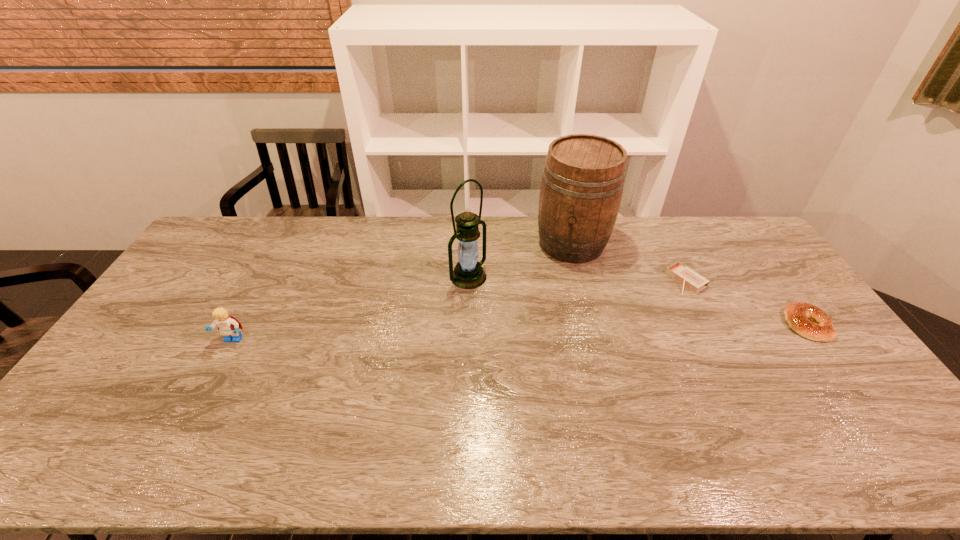
The width and height of the screenshot is (960, 540). In order to click on vacant space on the desktop that is between the third shortest object and the rightmost object and is positioned on the side where the lantern emits light in this screenshot , I will do `click(549, 332)`.

Where is `vacant space on the desktop that is between the third shortest object and the rightmost object and is positioned on the side of the cider near the bung hole`? Image resolution: width=960 pixels, height=540 pixels. vacant space on the desktop that is between the third shortest object and the rightmost object and is positioned on the side of the cider near the bung hole is located at coordinates (544, 332).

Identify the location of free spot on the desktop that is between the Lego and the rightmost object and is positioned on the striking surface of the matchbox. This screenshot has width=960, height=540. [600, 330].